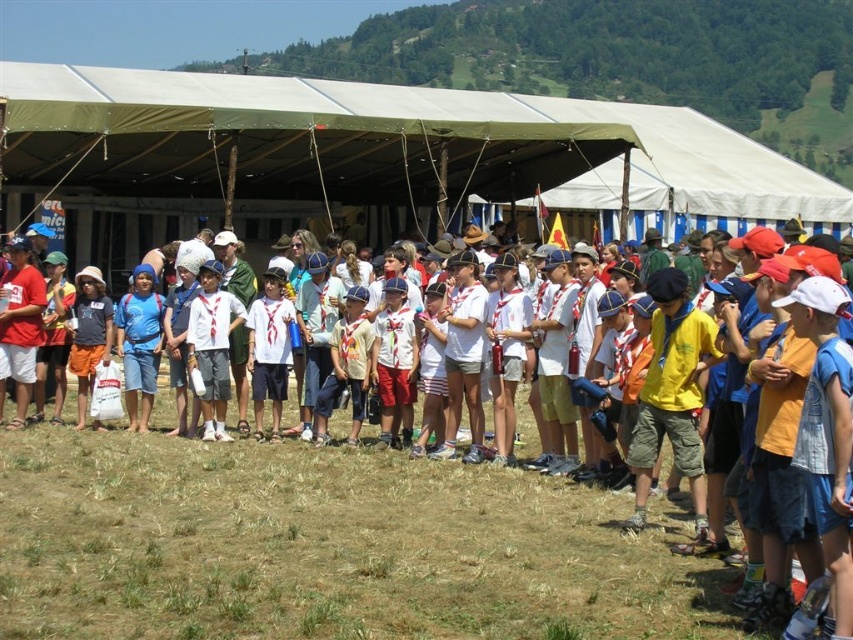
Can you confirm if white cotton shirt at center is positioned to the left of matte blue shorts at center?

No, white cotton shirt at center is not to the left of matte blue shorts at center.

Which is above, white cotton shirt at center or matte blue shorts at center?

matte blue shorts at center is above.

Locate an element on the screen. The width and height of the screenshot is (853, 640). white cotton shirt at center is located at coordinates (328, 547).

Find the location of a particular element. white cotton shirt at center is located at coordinates 328,547.